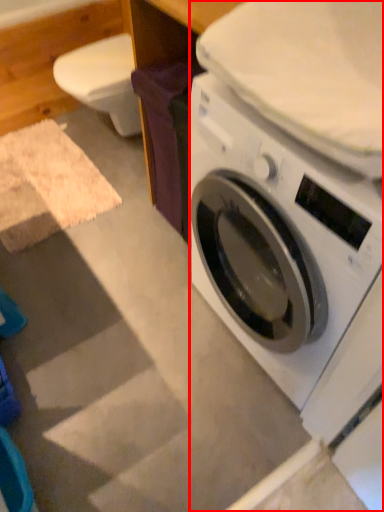
Question: From the image's perspective, where is washing machine (annotated by the red box) located relative to table?

Choices:
 (A) below
 (B) above

Answer: (A)